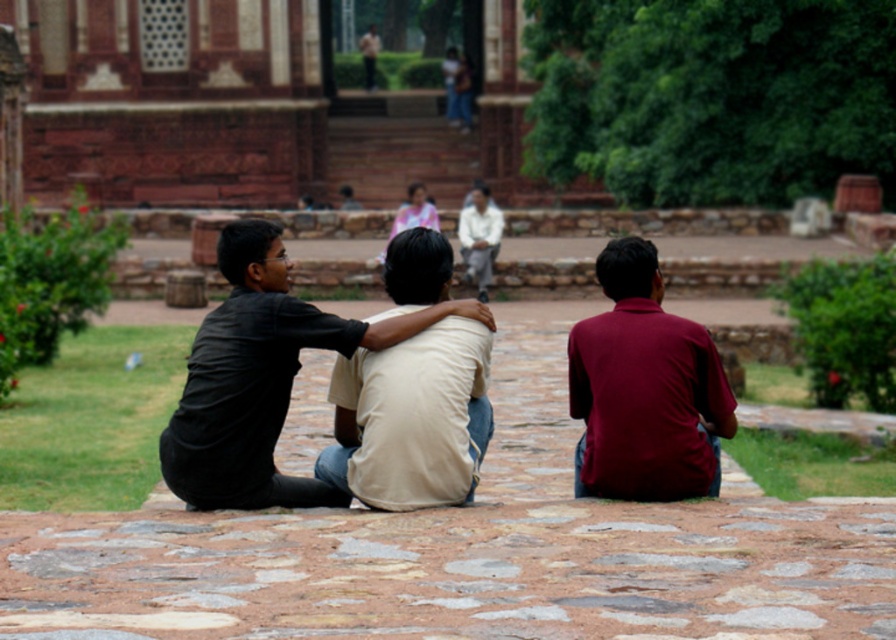
You are standing on the stone pathway and want to hand a note to the person wearing the matte black shirt at center without disturbing the person in the maroon cotton shirt at center. How can you approach them?

Since the matte black shirt at center is closer to the viewer than the maroon cotton shirt at center, you can approach directly towards the matte black shirt at center from the front without needing to go around the maroon cotton shirt at center.

You are a photographer planning to take a group photo of the matte black shirt at center and the maroon cotton shirt at center. Since you want both shirts to appear the same size in the photo, which person should you move closer to the camera?

The matte black shirt at center is larger in size compared to the maroon cotton shirt at center. To make both shirts appear the same size in the photo, you should move the matte black shirt at center farther away from the camera while keeping the maroon cotton shirt at center in its current position.